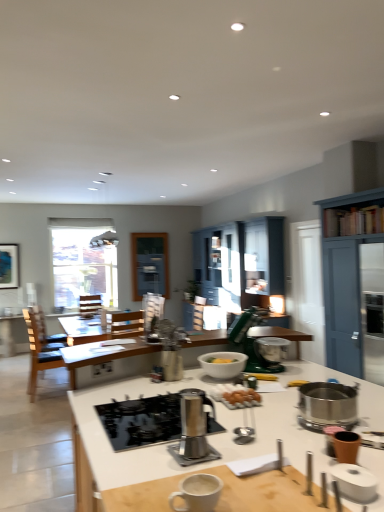
Question: Which direction should I rotate to look at matte plastic armchair at center, which appears as the second armchair when viewed from the back?

Choices:
 (A) right
 (B) left

Answer: (B)

Question: From a real-world perspective, is brown matte cup at lower right, which ranks as the fourth appliance in back-to-front order, over brown fabric armchair at center, acting as the second armchair starting from the top?

Choices:
 (A) no
 (B) yes

Answer: (B)

Question: Does brown matte cup at lower right, marked as the second appliance in a front-to-back arrangement, have a larger size compared to brown fabric armchair at center, marked as the second armchair in a right-to-left arrangement?

Choices:
 (A) yes
 (B) no

Answer: (B)

Question: Is brown matte cup at lower right, which ranks as the fourth appliance in back-to-front order, oriented towards brown fabric armchair at center, acting as the first armchair starting from the bottom?

Choices:
 (A) no
 (B) yes

Answer: (A)

Question: Does brown matte cup at lower right, marked as the second appliance in a front-to-back arrangement, have a lesser height compared to brown fabric armchair at center, marked as the 1th armchair in a back-to-front arrangement?

Choices:
 (A) yes
 (B) no

Answer: (A)

Question: From a real-world perspective, is brown matte cup at lower right, which ranks as the fourth appliance in back-to-front order, physically below brown fabric armchair at center, marked as the 1th armchair in a back-to-front arrangement?

Choices:
 (A) no
 (B) yes

Answer: (A)

Question: Is brown matte cup at lower right, marked as the second appliance in a front-to-back arrangement, outside of brown fabric armchair at center, arranged as the first armchair when viewed from the left?

Choices:
 (A) no
 (B) yes

Answer: (B)

Question: Does brown matte cup at lower right, marked as the second appliance in a front-to-back arrangement, lie behind stainless steel gas stove at center?

Choices:
 (A) no
 (B) yes

Answer: (A)

Question: Could you tell me if brown matte cup at lower right, marked as the second appliance in a front-to-back arrangement, is facing stainless steel gas stove at center?

Choices:
 (A) yes
 (B) no

Answer: (B)

Question: Is stainless steel gas stove at center a part of brown matte cup at lower right, which ranks as the fourth appliance in back-to-front order?

Choices:
 (A) yes
 (B) no

Answer: (B)

Question: From the image's perspective, is brown matte cup at lower right, marked as the second appliance in a front-to-back arrangement, below stainless steel gas stove at center?

Choices:
 (A) yes
 (B) no

Answer: (B)

Question: Is brown matte cup at lower right, which ranks as the fourth appliance in back-to-front order, not near stainless steel gas stove at center?

Choices:
 (A) no
 (B) yes

Answer: (A)

Question: Considering the relative sizes of brown matte cup at lower right, marked as the second appliance in a front-to-back arrangement, and stainless steel gas stove at center in the image provided, is brown matte cup at lower right, marked as the second appliance in a front-to-back arrangement, smaller than stainless steel gas stove at center?

Choices:
 (A) no
 (B) yes

Answer: (B)

Question: Is clear glass window at upper left aimed at blue painted wood cabinet at right, the second cabinetry from the left?

Choices:
 (A) yes
 (B) no

Answer: (A)